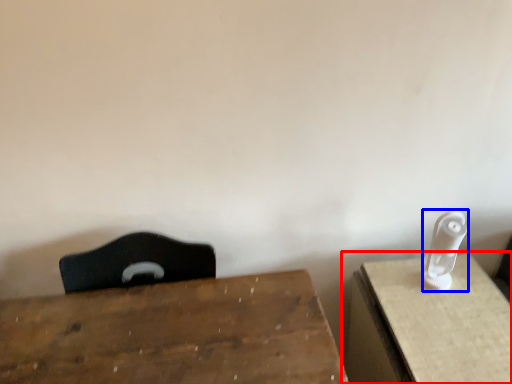
Question: Among these objects, which one is nearest to the camera, table (highlighted by a red box) or Wii controller (highlighted by a blue box)?

Choices:
 (A) table
 (B) Wii controller

Answer: (A)